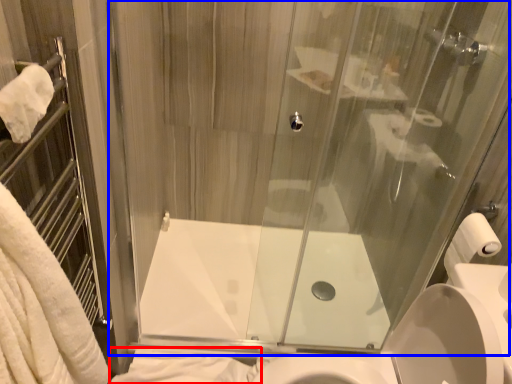
Question: Which point is closer to the camera, bath towel (highlighted by a red box) or glass door (highlighted by a blue box)?

Choices:
 (A) bath towel
 (B) glass door

Answer: (B)